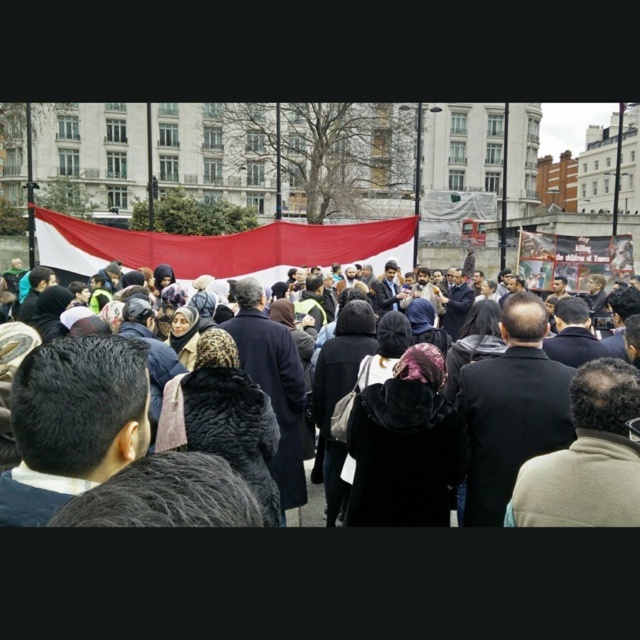
Is point (384, 236) positioned before point (200, 298)?

No, it is behind (200, 298).

Between point (225, 236) and point (170, 352), which one is positioned behind?

Positioned behind is point (225, 236).

Which is in front, point (224, 256) or point (29, 278)?

Point (29, 278) is in front.

At what (x,y) coordinates should I click in order to perform the action: click on red fabric banner at center. Please return your answer as a coordinate pair (x, y). Looking at the image, I should click on (221, 246).